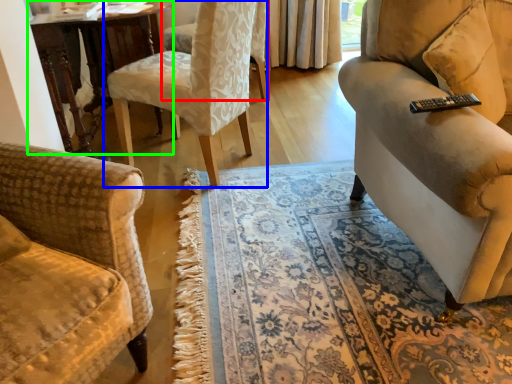
Question: Considering the real-world distances, which object is farthest from chair (highlighted by a red box)? chair (highlighted by a blue box) or table (highlighted by a green box)?

Choices:
 (A) chair
 (B) table

Answer: (A)